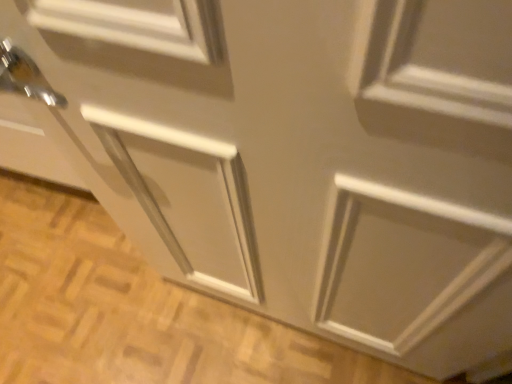
The width and height of the screenshot is (512, 384). What do you see at coordinates (134, 310) in the screenshot? I see `matte white cabinet at lower center` at bounding box center [134, 310].

Find the location of a particular element. matte white cabinet at lower center is located at coordinates (134, 310).

Identify the location of matte white cabinet at lower center. (134, 310).